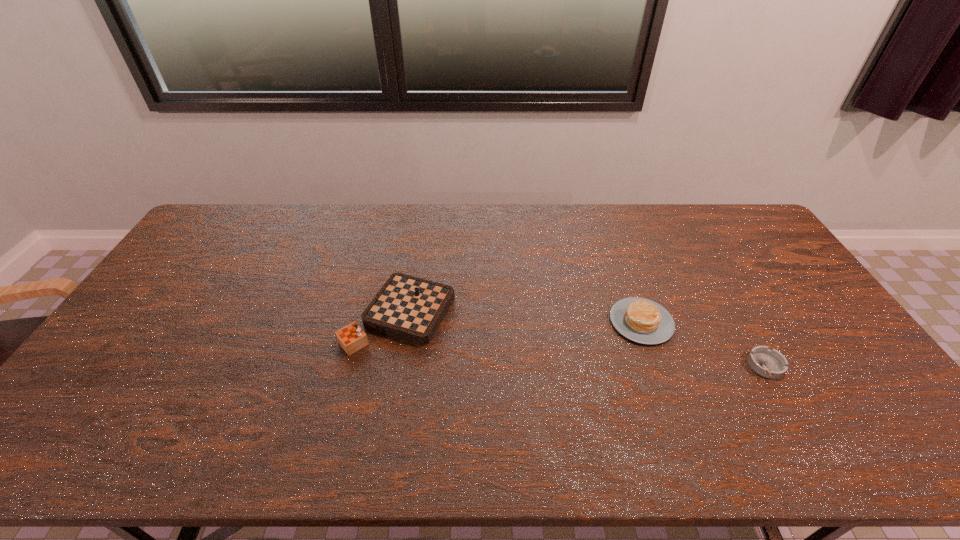
Locate an element on the screen. The height and width of the screenshot is (540, 960). vacant space that is in between the ashtray and the chessboard is located at coordinates (583, 341).

Identify the location of vacant point located between the second object from right to left and the chessboard. (520, 319).

In order to click on free space between the shortest object and the pancake in this screenshot , I will do `click(704, 344)`.

The height and width of the screenshot is (540, 960). What are the coordinates of `free space between the chessboard and the ashtray` in the screenshot? It's located at (583, 341).

You are a GUI agent. You are given a task and a screenshot of the screen. Output one action in this format:
    pyautogui.click(x=<x>, y=<y>)
    Task: Click on the vacant space in between the chessboard and the rightmost object
    This screenshot has width=960, height=540.
    Given the screenshot: What is the action you would take?
    pyautogui.click(x=583, y=341)

Locate an element on the screen. The height and width of the screenshot is (540, 960). object that ranks as the second closest to the leftmost object is located at coordinates (768, 363).

This screenshot has height=540, width=960. I want to click on the second closest object to the rightmost object, so click(x=410, y=308).

The image size is (960, 540). What are the coordinates of `free location that satisfies the following two spatial constraints: 1. on the front side of the leftmost object; 2. on the right side of the pancake` in the screenshot? It's located at (398, 322).

Identify the location of vacant space that satisfies the following two spatial constraints: 1. on the front side of the leftmost object; 2. on the right side of the rightmost object. The width and height of the screenshot is (960, 540). (391, 366).